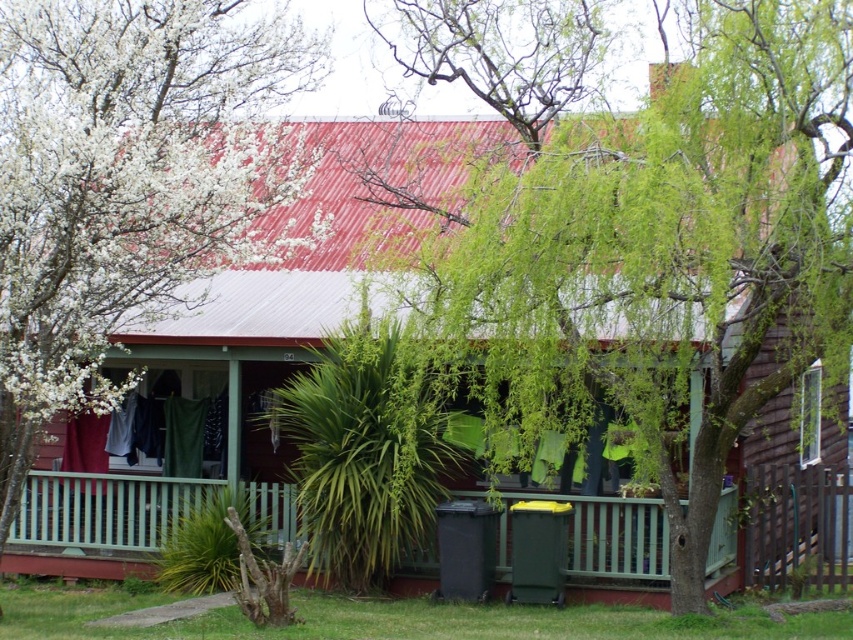
Question: Where is green leafy tree at center located in relation to white blossoming branches at upper left in the image?

Choices:
 (A) right
 (B) left

Answer: (A)

Question: Is green leafy tree at center to the right of white blossoming branches at upper left from the viewer's perspective?

Choices:
 (A) yes
 (B) no

Answer: (A)

Question: Which object is closer to the camera taking this photo?

Choices:
 (A) white blossoming branches at upper left
 (B) green wooden porch at center

Answer: (A)

Question: Which point is farther to the camera?

Choices:
 (A) green wooden porch at center
 (B) white blossoming branches at upper left

Answer: (A)

Question: Estimate the real-world distances between objects in this image. Which object is closer to the green leafy tree at center?

Choices:
 (A) green wooden porch at center
 (B) white blossoming branches at upper left

Answer: (B)

Question: Is white blossoming branches at upper left thinner than green wooden porch at center?

Choices:
 (A) yes
 (B) no

Answer: (A)